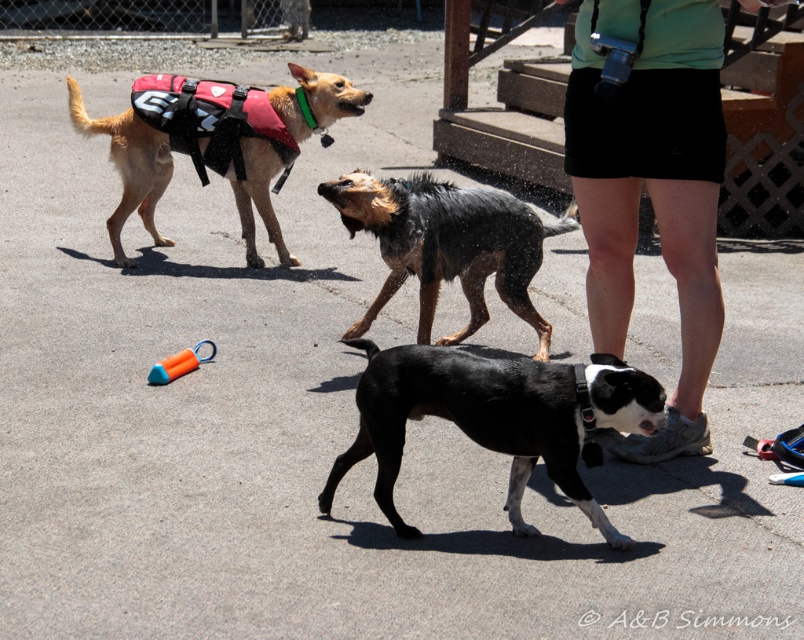
Consider the image. Does black matte dog at center have a lesser width compared to orange rubber toy at center?

No, black matte dog at center is not thinner than orange rubber toy at center.

Who is more forward, (634, 404) or (170, 378)?

Point (634, 404) is more forward.

Is point (581, 440) behind point (183, 349)?

No, it is not.

Locate an element on the screen. black matte dog at center is located at coordinates (470, 420).

Can you confirm if shiny black fur at center is smaller than orange rubber toy at center?

Incorrect, shiny black fur at center is not smaller in size than orange rubber toy at center.

Identify the location of shiny black fur at center. (446, 244).

Is red life vest at upper left below red synthetic life jacket at upper left?

Yes, red life vest at upper left is below red synthetic life jacket at upper left.

Is point (240, 205) less distant than point (277, 116)?

No, (240, 205) is further to viewer.

Is point (134, 129) behind point (290, 148)?

No, (134, 129) is closer to viewer.

Locate an element on the screen. This screenshot has width=804, height=640. red life vest at upper left is located at coordinates (128, 164).